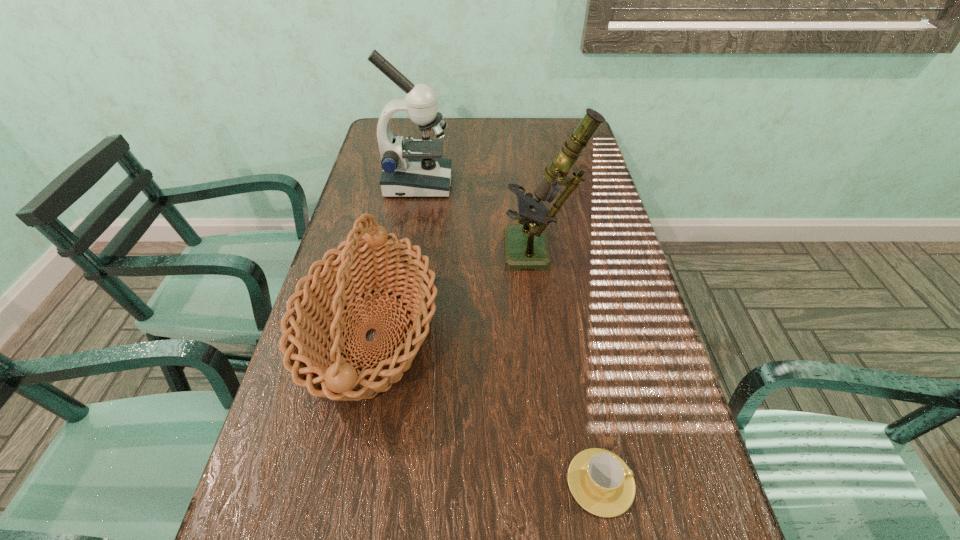
Where is `vacant space situated on the right of the basket`? vacant space situated on the right of the basket is located at coordinates (493, 337).

You are a GUI agent. You are given a task and a screenshot of the screen. Output one action in this format:
    pyautogui.click(x=<x>, y=<y>)
    Task: Click on the microscope situated at the left edge
    The image size is (960, 540).
    Given the screenshot: What is the action you would take?
    pyautogui.click(x=415, y=168)

Where is `basket present at the left edge`? This screenshot has height=540, width=960. basket present at the left edge is located at coordinates (316, 309).

Locate an element on the screen. The height and width of the screenshot is (540, 960). microscope positioned at the right edge is located at coordinates (526, 247).

Locate an element on the screen. cup present at the right edge is located at coordinates (600, 481).

What are the coordinates of `vacant area at the far edge` in the screenshot? It's located at (533, 130).

Identify the location of blank area at the left edge. This screenshot has width=960, height=540. (372, 167).

The image size is (960, 540). Find the location of `free space at the right edge of the desktop`. free space at the right edge of the desktop is located at coordinates [x=609, y=440].

Where is `free space at the far left corner of the desktop`? The image size is (960, 540). free space at the far left corner of the desktop is located at coordinates (397, 129).

Locate an element on the screen. This screenshot has height=540, width=960. vacant space at the far right corner is located at coordinates (547, 129).